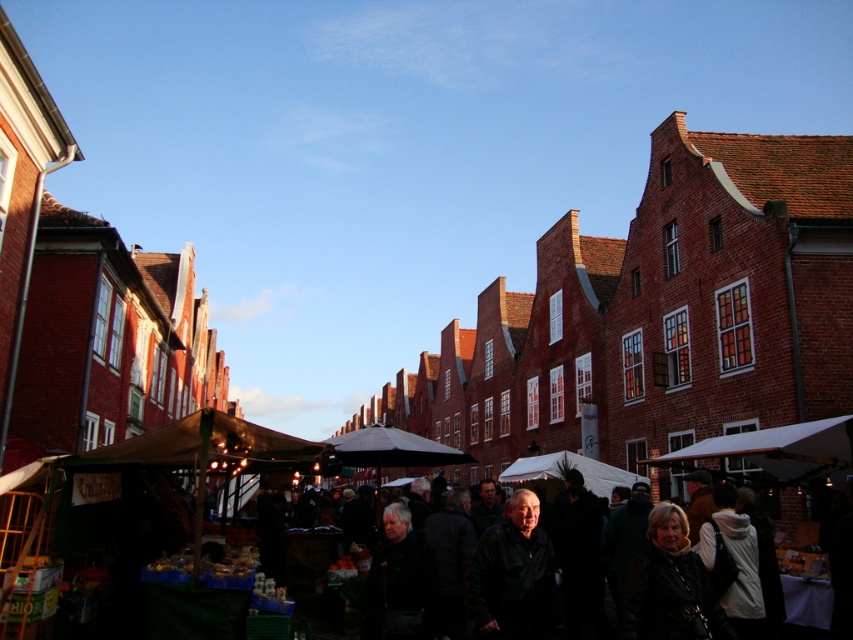
Question: Which of the following is the farthest from the observer?

Choices:
 (A) (482, 579)
 (B) (693, 611)

Answer: (A)

Question: Which of the following is the farthest from the observer?

Choices:
 (A) (492, 618)
 (B) (135, 442)

Answer: (B)

Question: Does black leather jacket at center lie in front of dark brown leather jacket at lower right?

Choices:
 (A) yes
 (B) no

Answer: (B)

Question: Can you confirm if green fabric market stall at center is positioned to the left of black leather jacket at center?

Choices:
 (A) no
 (B) yes

Answer: (B)

Question: Does black leather jacket at center appear under dark brown leather jacket at lower right?

Choices:
 (A) yes
 (B) no

Answer: (A)

Question: Which point is closer to the camera taking this photo?

Choices:
 (A) (624, 624)
 (B) (183, 449)
 (C) (483, 564)

Answer: (A)